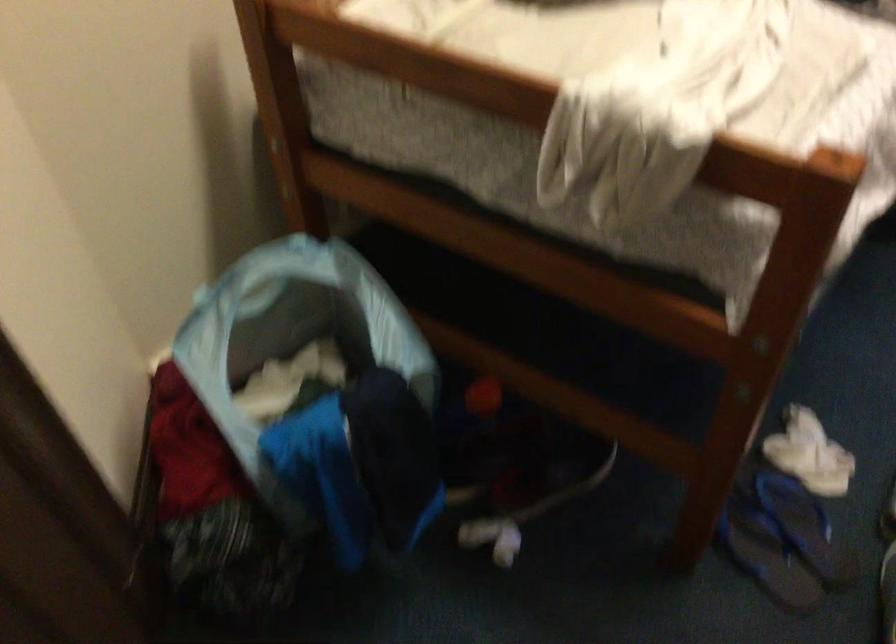
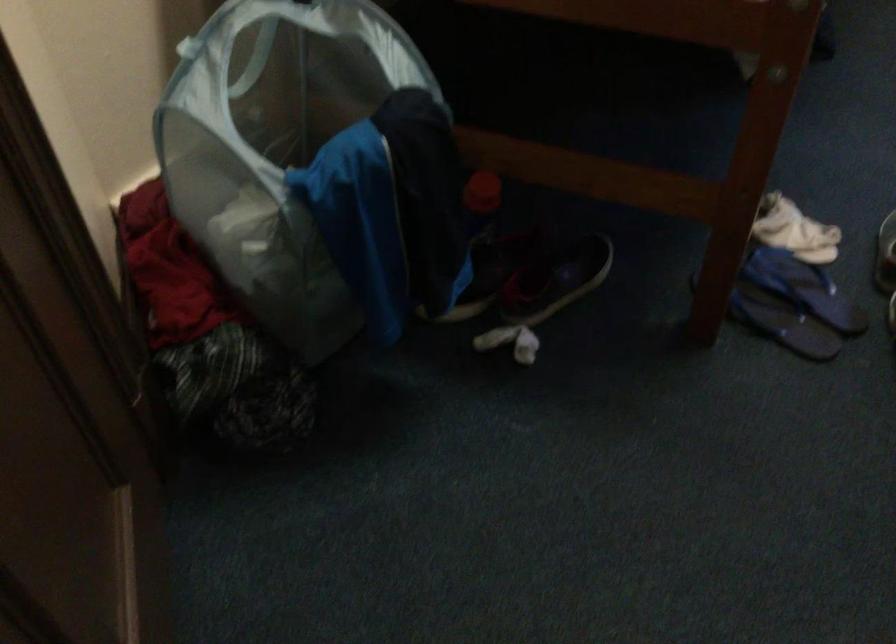
In the second image, find the point that corresponds to pixel 765 565 in the first image.

(782, 323)